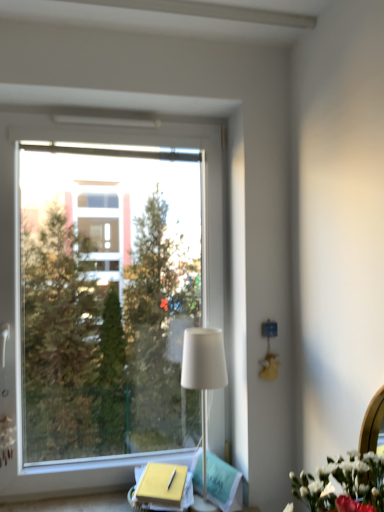
Where is `white fabric lampshade at center`? The height and width of the screenshot is (512, 384). white fabric lampshade at center is located at coordinates (203, 373).

What do you see at coordinates (203, 373) in the screenshot?
I see `white fabric lampshade at center` at bounding box center [203, 373].

This screenshot has height=512, width=384. I want to click on transparent glass window at left, so click(19, 271).

In order to face transparent glass window at left, should I rotate leftwards or rightwards?

It's best to rotate left around 9.677 degrees.

The height and width of the screenshot is (512, 384). Describe the element at coordinates (19, 271) in the screenshot. I see `transparent glass window at left` at that location.

I want to click on white fabric lampshade at center, so click(x=203, y=373).

Is transparent glass window at left to the left or to the right of white fabric lampshade at center in the image?

In the image, transparent glass window at left appears on the left side of white fabric lampshade at center.

Is transparent glass window at left further to camera compared to white fabric lampshade at center?

Yes, it is behind white fabric lampshade at center.

Which is in front, point (211, 146) or point (205, 402)?

The point (211, 146) is closer to the camera.

From the image's perspective, is transparent glass window at left on white fabric lampshade at center?

Yes, from the image's perspective, transparent glass window at left is above white fabric lampshade at center.

From a real-world perspective, is transparent glass window at left on top of white fabric lampshade at center?

Yes.

Is transparent glass window at left thinner than white fabric lampshade at center?

Indeed, transparent glass window at left has a lesser width compared to white fabric lampshade at center.

Who is taller, transparent glass window at left or white fabric lampshade at center?

transparent glass window at left is taller.

Which of these two, transparent glass window at left or white fabric lampshade at center, is smaller?

white fabric lampshade at center is smaller.

From the picture: Is transparent glass window at left not within white fabric lampshade at center?

Absolutely, transparent glass window at left is external to white fabric lampshade at center.

Is transparent glass window at left placed right next to white fabric lampshade at center?

transparent glass window at left and white fabric lampshade at center are clearly separated.

From the picture: Is transparent glass window at left oriented towards white fabric lampshade at center?

Yes, transparent glass window at left faces towards white fabric lampshade at center.

Identify the location of window on the left side of white fabric lampshade at center. This screenshot has width=384, height=512. tap(19, 271).

In the scene shown: Can you confirm if white fabric lampshade at center is positioned to the left of transparent glass window at left?

No.

Consider the image. Is white fabric lampshade at center in front of or behind transparent glass window at left in the image?

Visually, white fabric lampshade at center is located in front of transparent glass window at left.

Is point (203, 469) closer or farther from the camera than point (215, 399)?

Clearly, point (203, 469) is closer to the camera than point (215, 399).

From the image's perspective, is white fabric lampshade at center over transparent glass window at left?

No, from the image's perspective, white fabric lampshade at center is not on top of transparent glass window at left.

From a real-world perspective, does white fabric lampshade at center stand above transparent glass window at left?

Incorrect, from a real-world perspective, white fabric lampshade at center is lower than transparent glass window at left.

Does white fabric lampshade at center have a lesser width compared to transparent glass window at left?

In fact, white fabric lampshade at center might be wider than transparent glass window at left.

Considering the sizes of objects white fabric lampshade at center and transparent glass window at left in the image provided, who is taller, white fabric lampshade at center or transparent glass window at left?

transparent glass window at left.

Does white fabric lampshade at center have a larger size compared to transparent glass window at left?

Actually, white fabric lampshade at center might be smaller than transparent glass window at left.

Is white fabric lampshade at center completely or partially outside of transparent glass window at left?

white fabric lampshade at center is positioned outside transparent glass window at left.

Would you say white fabric lampshade at center is a long distance from transparent glass window at left?

No, there isn't a large distance between white fabric lampshade at center and transparent glass window at left.

Is white fabric lampshade at center turned away from transparent glass window at left?

Yes, transparent glass window at left is at the back of white fabric lampshade at center.

How many degrees apart are the facing directions of white fabric lampshade at center and transparent glass window at left?

4.36e-05 degrees.

The height and width of the screenshot is (512, 384). I want to click on lamp below the transparent glass window at left (from a real-world perspective), so click(203, 373).

At what (x,y) coordinates should I click in order to perform the action: click on lamp on the right of transparent glass window at left. Please return your answer as a coordinate pair (x, y). Looking at the image, I should click on (203, 373).

The height and width of the screenshot is (512, 384). Identify the location of lamp located below the transparent glass window at left (from the image's perspective). (203, 373).